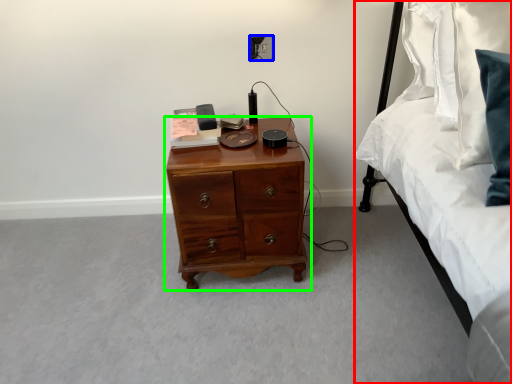
Question: Based on their relative distances, which object is nearer to bed (highlighted by a red box)? Choose from electric outlet (highlighted by a blue box) and chest of drawers (highlighted by a green box).

Choices:
 (A) electric outlet
 (B) chest of drawers

Answer: (B)